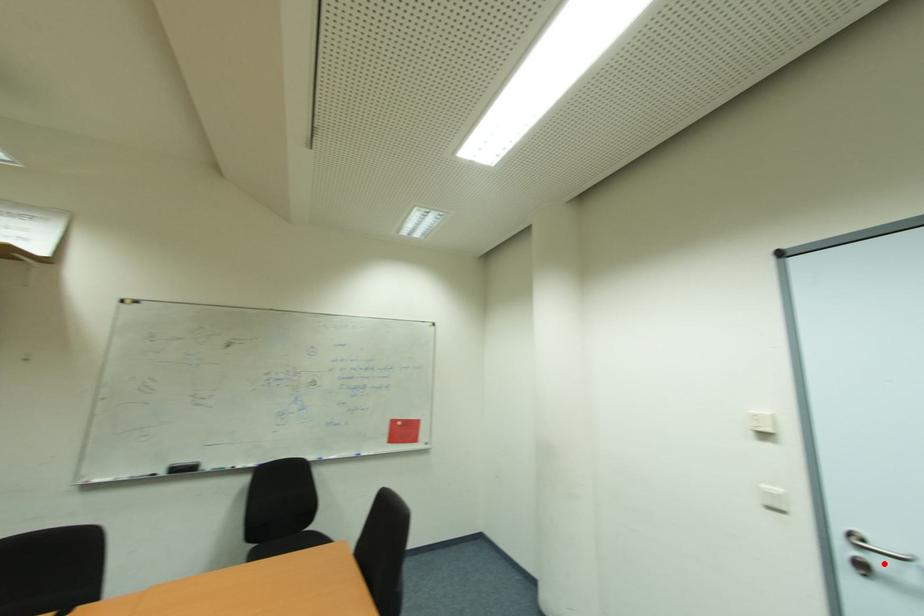
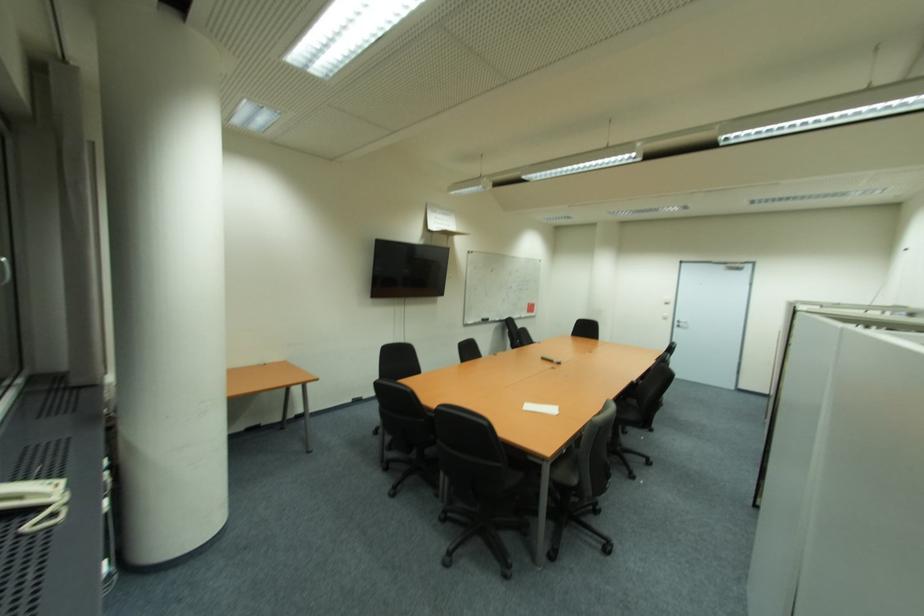
Find the pixel in the second image that matches the highlighted location in the first image.

(686, 325)